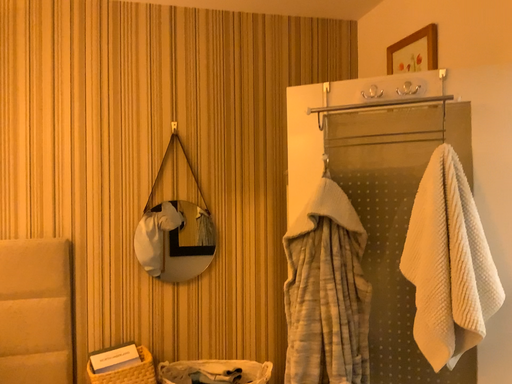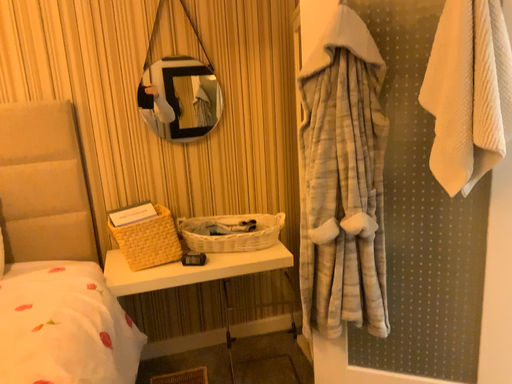
Question: Which way did the camera rotate in the video?

Choices:
 (A) rotated downward
 (B) rotated upward

Answer: (A)